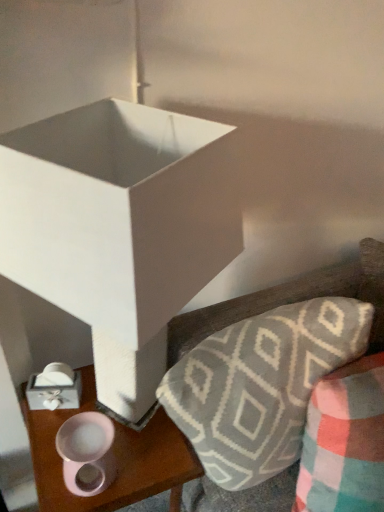
Locate an element on the screen. This screenshot has height=512, width=384. vacant area on top of pink glossy mug at lower left (from a real-world perspective) is located at coordinates (113, 443).